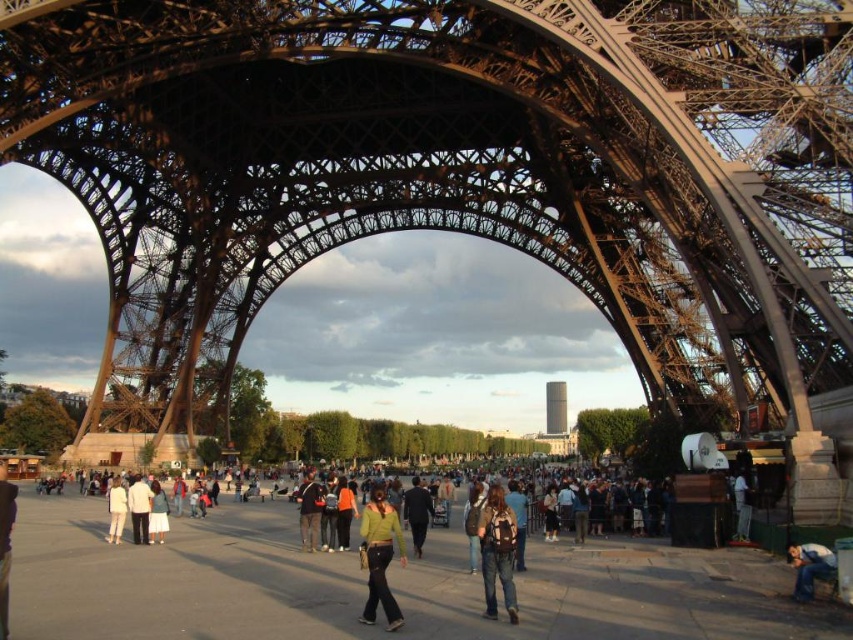
Between green knit sweater at center and white cotton shirt at lower left, which one is positioned lower?

Positioned lower is white cotton shirt at lower left.

Is point (393, 620) farther from viewer compared to point (111, 509)?

That is False.

The width and height of the screenshot is (853, 640). I want to click on green knit sweater at center, so click(380, 556).

Describe the element at coordinates (309, 509) in the screenshot. The width and height of the screenshot is (853, 640). I see `dark gray backpack at center` at that location.

Is point (312, 547) positioned after point (111, 531)?

Yes.

Which is in front, point (318, 496) or point (113, 528)?

Point (113, 528)

Where is `dark gray backpack at center`? dark gray backpack at center is located at coordinates (309, 509).

Between point (386, 586) and point (561, 385), which one is positioned behind?

The point (561, 385) is behind.

Can you confirm if green knit sweater at center is shorter than smooth glass tower at center?

Indeed, green knit sweater at center has a lesser height compared to smooth glass tower at center.

Does point (399, 531) come behind point (560, 388)?

No, it is in front of (560, 388).

Where is `green knit sweater at center`? green knit sweater at center is located at coordinates (380, 556).